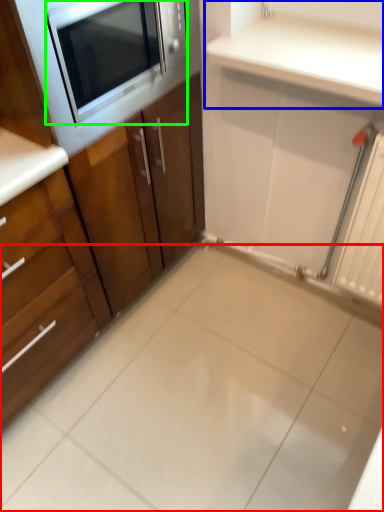
Question: Which is nearer to the ceramic tile (highlighted by a red box)? countertop (highlighted by a blue box) or microwave oven (highlighted by a green box).

Choices:
 (A) countertop
 (B) microwave oven

Answer: (A)